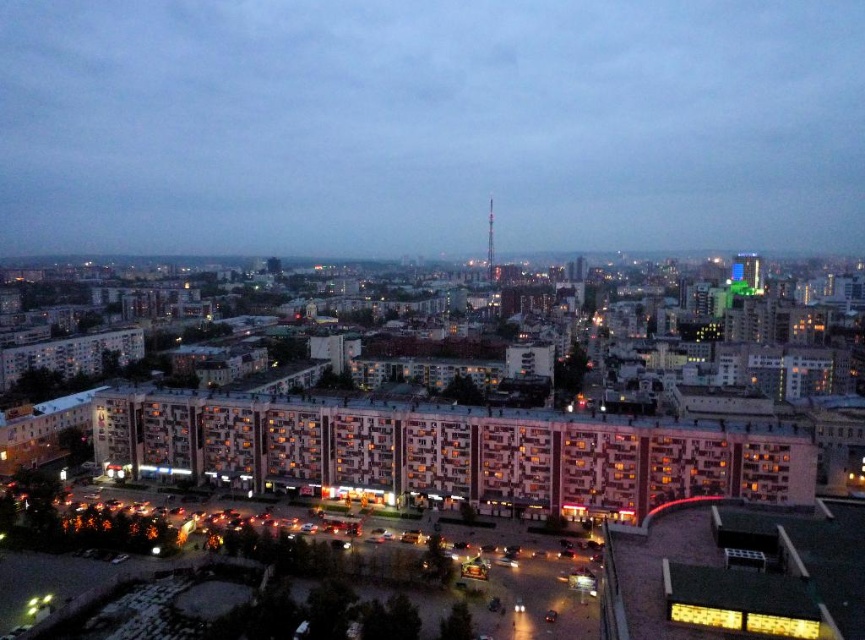
Question: Can you confirm if smooth concrete tower at center is wider than metallic silver tv tower at center?

Choices:
 (A) no
 (B) yes

Answer: (B)

Question: Among these points, which one is nearest to the camera?

Choices:
 (A) (366, 102)
 (B) (492, 209)

Answer: (B)

Question: Does smooth concrete tower at center appear on the right side of metallic silver tv tower at center?

Choices:
 (A) yes
 (B) no

Answer: (B)

Question: Is smooth concrete tower at center wider than metallic silver tv tower at center?

Choices:
 (A) yes
 (B) no

Answer: (A)